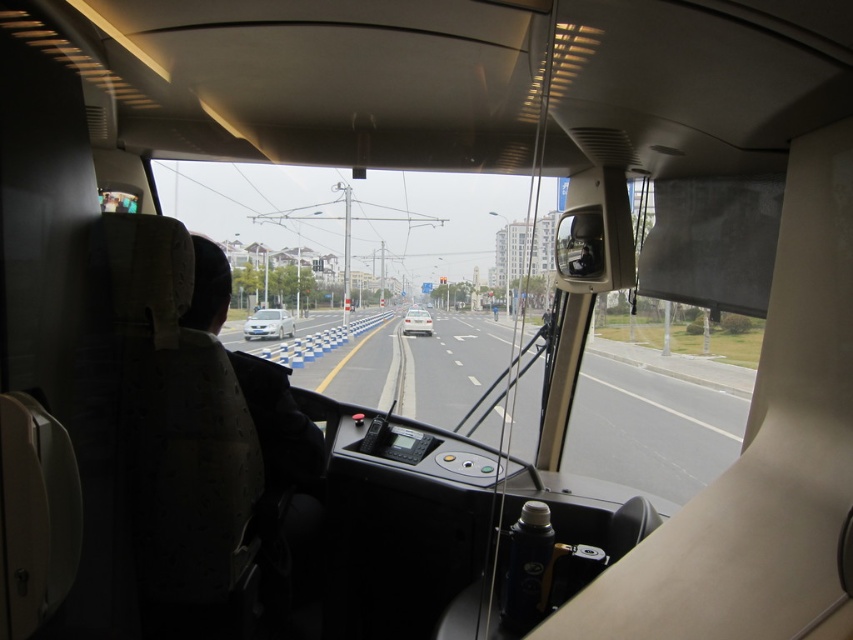
Can you confirm if transparent glass windshield at center is wider than black fabric jacket at left?

Correct, the width of transparent glass windshield at center exceeds that of black fabric jacket at left.

Is the position of transparent glass windshield at center more distant than that of black fabric jacket at left?

Yes, it is behind black fabric jacket at left.

Between point (595, 477) and point (310, 484), which one is positioned in front?

Point (310, 484) is in front.

Locate an element on the screen. The image size is (853, 640). transparent glass windshield at center is located at coordinates (390, 280).

Who is taller, asphalt road at center or black fabric jacket at left?

asphalt road at center

Can you confirm if asphalt road at center is positioned below black fabric jacket at left?

Indeed, asphalt road at center is positioned under black fabric jacket at left.

At what (x,y) coordinates should I click in order to perform the action: click on asphalt road at center. Please return your answer as a coordinate pair (x, y). This screenshot has height=640, width=853. Looking at the image, I should click on (650, 428).

Locate an element on the screen. This screenshot has height=640, width=853. transparent glass windshield at center is located at coordinates (390, 280).

Is transparent glass windshield at center wider than asphalt road at center?

Correct, the width of transparent glass windshield at center exceeds that of asphalt road at center.

Is point (395, 380) less distant than point (622, 413)?

No, it is not.

At what (x,y) coordinates should I click in order to perform the action: click on transparent glass windshield at center. Please return your answer as a coordinate pair (x, y). Looking at the image, I should click on (390, 280).